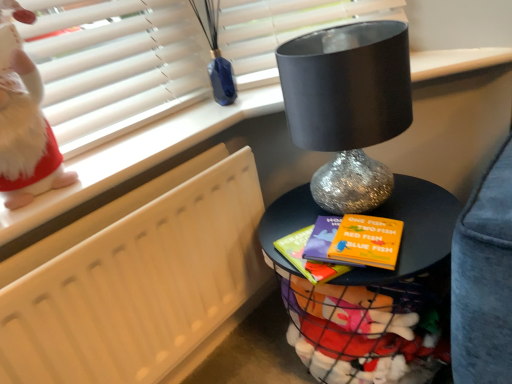
Identify the location of vacant area on top of white matte radiator at left (from a real-world perspective). This screenshot has width=512, height=384. (121, 193).